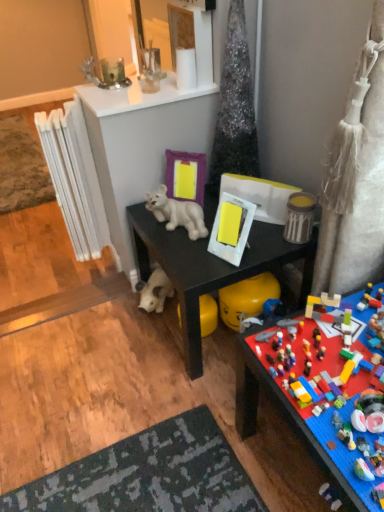
The image size is (384, 512). What are the coordinates of `vacant space that's between green glass candle at upper center, the 1th toy viewed from the top, and clear glass container at upper center, which is the 2th toy from top to bottom` in the screenshot? It's located at (133, 88).